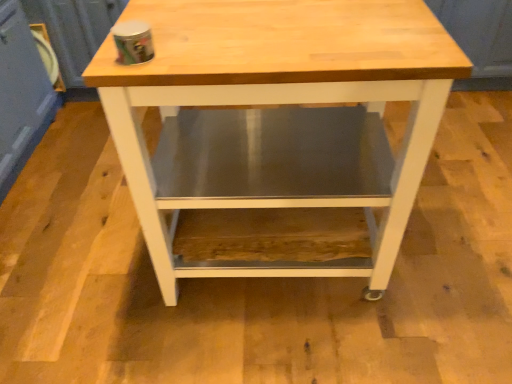
Question: Should I look upward or downward to see natural wood table at center?

Choices:
 (A) down
 (B) up

Answer: (B)